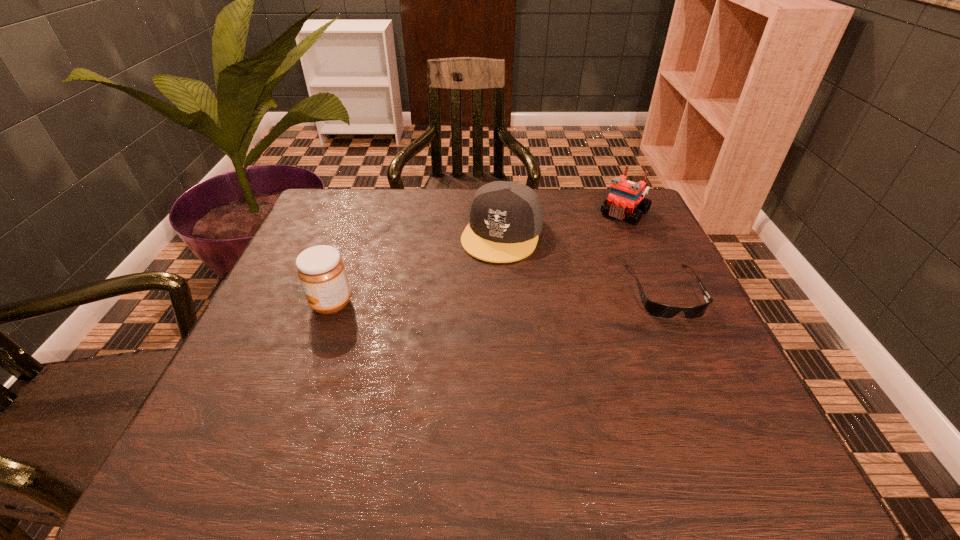
The height and width of the screenshot is (540, 960). What are the coordinates of `vacant space in between the shortest object and the cap` in the screenshot? It's located at tap(584, 262).

At what (x,y) coordinates should I click in order to perform the action: click on unoccupied area between the third object from right to left and the leftmost object. Please return your answer as a coordinate pair (x, y). This screenshot has height=540, width=960. Looking at the image, I should click on (417, 268).

This screenshot has width=960, height=540. Find the location of `object that stands as the third closest to the Lego`. object that stands as the third closest to the Lego is located at coordinates (321, 271).

Where is `object that is the third closest to the leftmost object`? The width and height of the screenshot is (960, 540). object that is the third closest to the leftmost object is located at coordinates (624, 195).

The image size is (960, 540). I want to click on vacant space that satisfies the following two spatial constraints: 1. on the back side of the cap; 2. on the right side of the Lego, so 501,213.